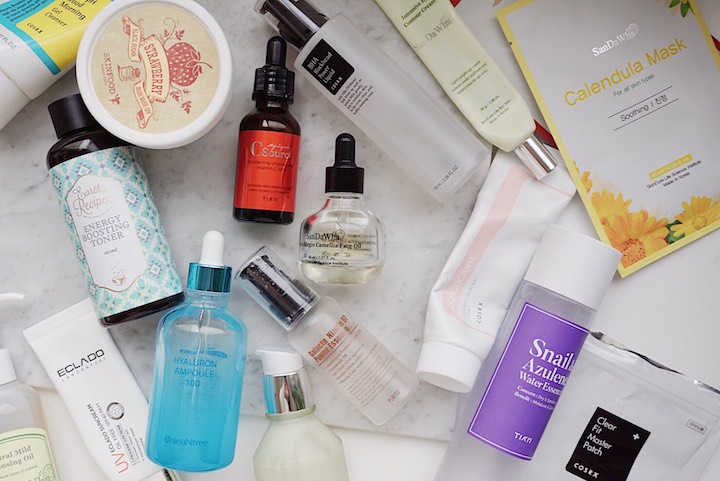
Where is `tub`? The height and width of the screenshot is (481, 720). tub is located at coordinates (119, 89).